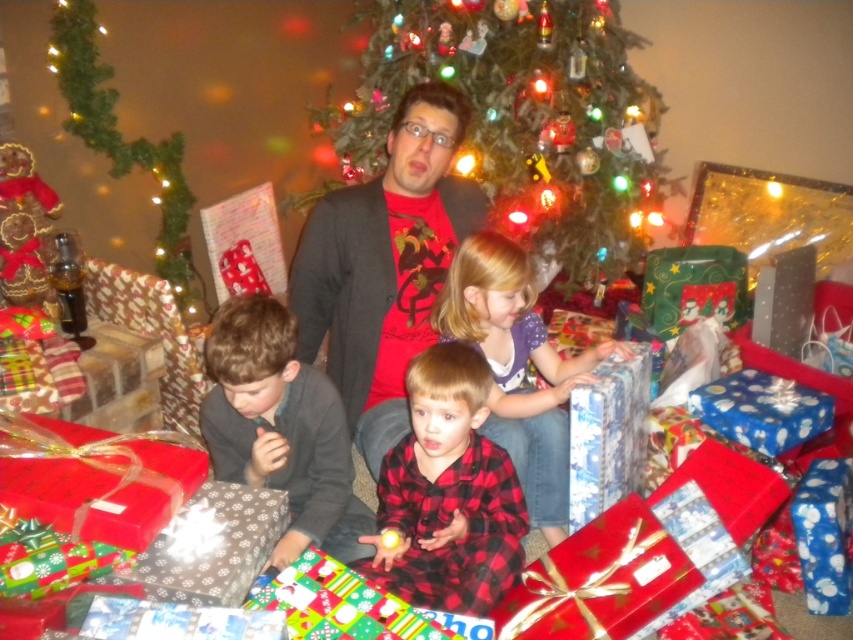
Question: From the image, what is the correct spatial relationship of shiny red wrapping paper at lower center in relation to blue shiny gift at center?

Choices:
 (A) above
 (B) below

Answer: (B)

Question: Which point is closer to the camera?

Choices:
 (A) silver metallic gift at lower left
 (B) green textured christmas tree at upper center

Answer: (A)

Question: Does shiny red wrapping paper at lower center have a larger size compared to blue shiny gift at center?

Choices:
 (A) no
 (B) yes

Answer: (A)

Question: Among these objects, which one is nearest to the camera?

Choices:
 (A) blue shiny gift at center
 (B) shiny red wrapping paper at lower center

Answer: (B)

Question: Can you confirm if matte black sweater at center is positioned to the right of red plaid shirt at center?

Choices:
 (A) yes
 (B) no

Answer: (B)

Question: Which object is positioned closest to the shiny red wrapping paper at lower center?

Choices:
 (A) dark gray sweater at lower left
 (B) green matte christmas tree at center

Answer: (A)